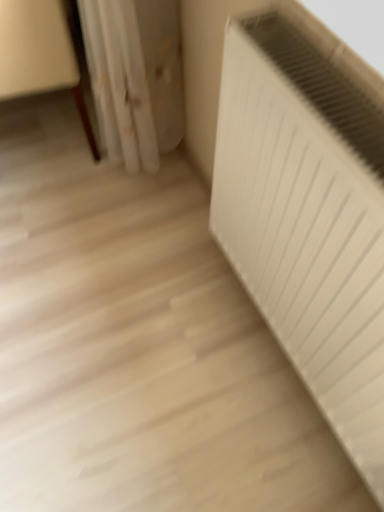
In order to click on white matte radiator at right in this screenshot , I will do `click(308, 213)`.

Image resolution: width=384 pixels, height=512 pixels. What do you see at coordinates (308, 213) in the screenshot? I see `white matte radiator at right` at bounding box center [308, 213].

Find the location of a particular element. The width and height of the screenshot is (384, 512). wooden floor at lower left is located at coordinates (39, 54).

The image size is (384, 512). What do you see at coordinates (39, 54) in the screenshot?
I see `wooden floor at lower left` at bounding box center [39, 54].

Identify the location of white matte radiator at right. coord(308,213).

Between wooden floor at lower left and white matte radiator at right, which one appears on the right side from the viewer's perspective?

From the viewer's perspective, white matte radiator at right appears more on the right side.

Is the depth of wooden floor at lower left greater than that of white matte radiator at right?

Yes, the depth of wooden floor at lower left is greater than that of white matte radiator at right.

Is point (70, 82) closer or farther from the camera than point (231, 30)?

Clearly, point (70, 82) is more distant from the camera than point (231, 30).

From the image's perspective, between wooden floor at lower left and white matte radiator at right, which one is located above?

wooden floor at lower left appears higher in the image.

From a real-world perspective, which object stands above the other?

From a 3D spatial view, white matte radiator at right is above.

Consider the image. Considering the relative sizes of wooden floor at lower left and white matte radiator at right in the image provided, is wooden floor at lower left thinner than white matte radiator at right?

Incorrect, the width of wooden floor at lower left is not less than that of white matte radiator at right.

Does wooden floor at lower left have a lesser height compared to white matte radiator at right?

In fact, wooden floor at lower left may be taller than white matte radiator at right.

Considering the sizes of objects wooden floor at lower left and white matte radiator at right in the image provided, who is smaller, wooden floor at lower left or white matte radiator at right?

white matte radiator at right.

Which is correct: wooden floor at lower left is inside white matte radiator at right, or outside of it?

wooden floor at lower left cannot be found inside white matte radiator at right.

Is wooden floor at lower left far away from white matte radiator at right?

No, wooden floor at lower left is in close proximity to white matte radiator at right.

Could you tell me if wooden floor at lower left is turned towards white matte radiator at right?

No, wooden floor at lower left is not turned towards white matte radiator at right.

Measure the distance between wooden floor at lower left and white matte radiator at right.

wooden floor at lower left is 31.31 inches away from white matte radiator at right.

The height and width of the screenshot is (512, 384). Find the location of `furniture to the left of white matte radiator at right`. furniture to the left of white matte radiator at right is located at coordinates (39, 54).

Can you confirm if white matte radiator at right is positioned to the right of wooden floor at lower left?

Indeed, white matte radiator at right is positioned on the right side of wooden floor at lower left.

In the image, is white matte radiator at right positioned in front of or behind wooden floor at lower left?

In the image, white matte radiator at right appears in front of wooden floor at lower left.

Does point (333, 410) come closer to viewer compared to point (72, 66)?

Yes, point (333, 410) is in front of point (72, 66).

From the image's perspective, is white matte radiator at right located above or below wooden floor at lower left?

white matte radiator at right is below wooden floor at lower left.

From a real-world perspective, is white matte radiator at right positioned above or below wooden floor at lower left?

white matte radiator at right is situated higher than wooden floor at lower left in the real world.

Between white matte radiator at right and wooden floor at lower left, which one has larger width?

wooden floor at lower left is wider.

Who is taller, white matte radiator at right or wooden floor at lower left?

wooden floor at lower left.

Considering the sizes of objects white matte radiator at right and wooden floor at lower left in the image provided, who is smaller, white matte radiator at right or wooden floor at lower left?

white matte radiator at right.

Would you say white matte radiator at right contains wooden floor at lower left?

No, wooden floor at lower left is located outside of white matte radiator at right.

Is there a large distance between white matte radiator at right and wooden floor at lower left?

No, white matte radiator at right is not far from wooden floor at lower left.

Is white matte radiator at right oriented towards wooden floor at lower left?

No, white matte radiator at right does not turn towards wooden floor at lower left.

How different are the orientations of white matte radiator at right and wooden floor at lower left in degrees?

The angle between the facing direction of white matte radiator at right and the facing direction of wooden floor at lower left is 95 degrees.

Measure the distance from white matte radiator at right to wooden floor at lower left.

They are 31.31 inches apart.

This screenshot has height=512, width=384. Identify the location of furniture that appears behind the white matte radiator at right. (39, 54).

Identify the location of furniture behind the white matte radiator at right. Image resolution: width=384 pixels, height=512 pixels. (39, 54).

Identify the location of radiator above the wooden floor at lower left (from a real-world perspective). (308, 213).